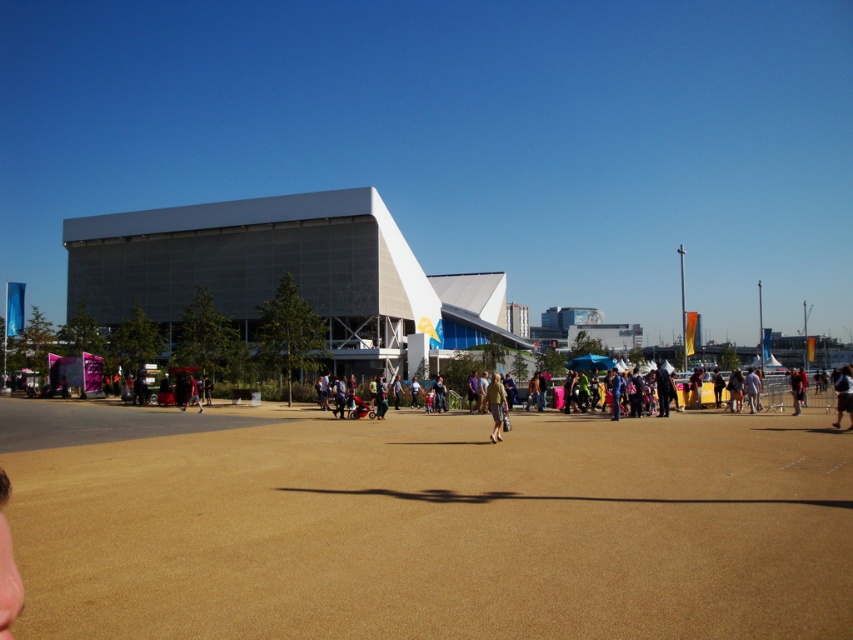
Question: Does gray metallic building at center have a larger size compared to khaki fabric pants at center?

Choices:
 (A) no
 (B) yes

Answer: (B)

Question: Estimate the real-world distances between objects in this image. Which object is farther from the khaki fabric pants at center?

Choices:
 (A) gray metallic building at center
 (B) dark blue jeans at lower right

Answer: (A)

Question: Which of these objects is positioned closest to the gray metallic building at center?

Choices:
 (A) brown textured dirt field at center
 (B) dark blue jeans at lower right

Answer: (A)

Question: Can you confirm if brown textured dirt field at center is positioned below dark blue jeans at lower right?

Choices:
 (A) no
 (B) yes

Answer: (B)

Question: Does brown textured dirt field at center lie in front of dark blue jeans at lower right?

Choices:
 (A) no
 (B) yes

Answer: (B)

Question: Which of these objects is positioned farthest from the brown textured dirt field at center?

Choices:
 (A) khaki fabric pants at center
 (B) dark blue jeans at lower right

Answer: (B)